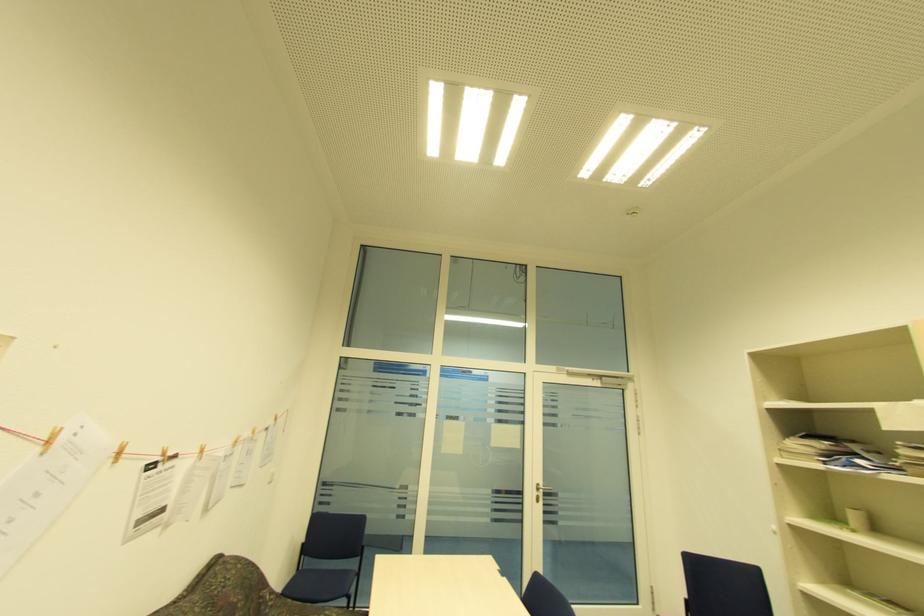
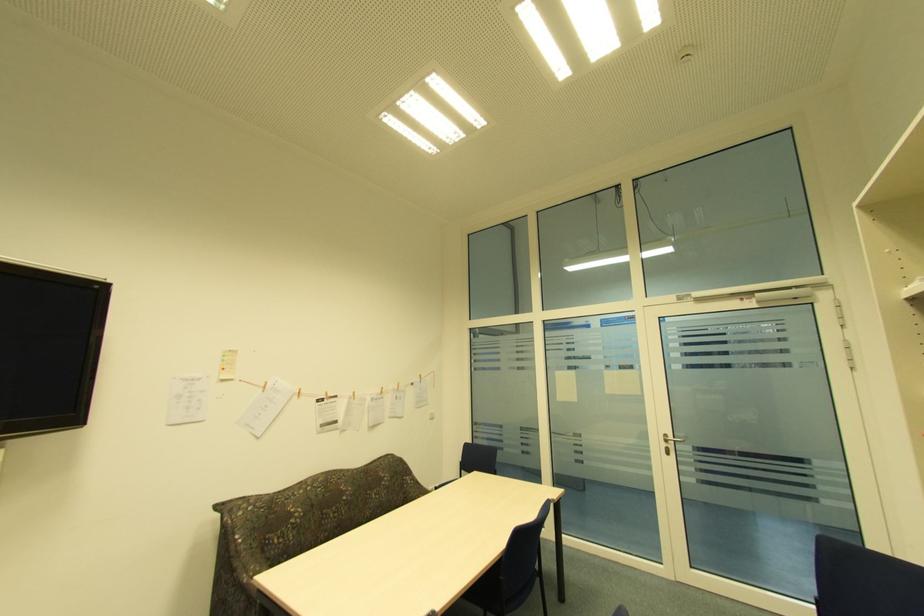
Locate, in the second image, the point that corresponds to point 538,493 in the first image.

(666, 445)